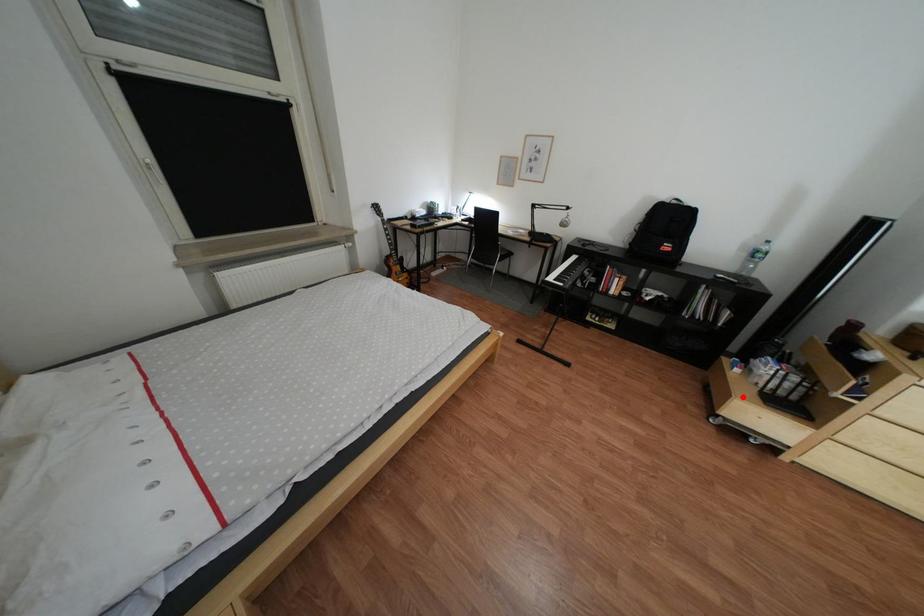
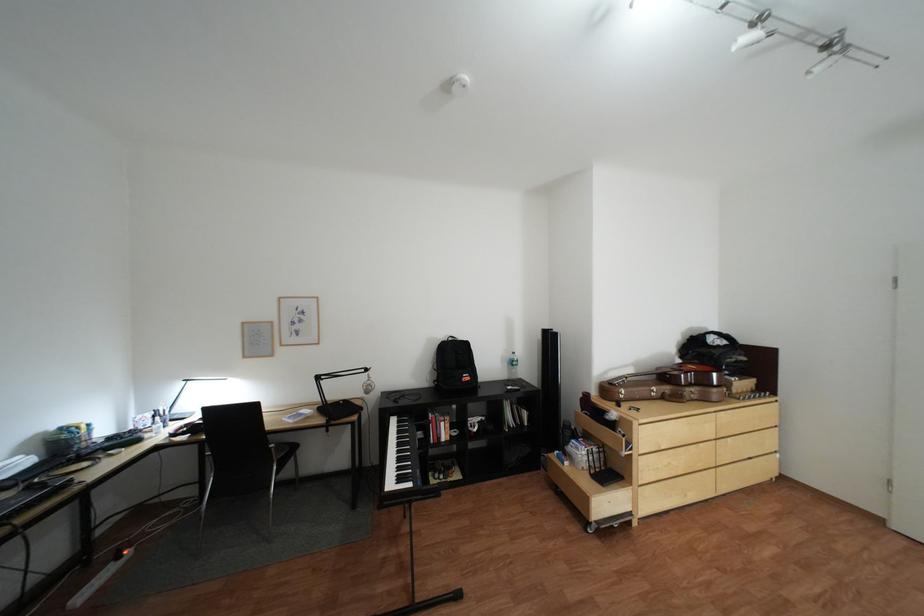
Question: A red point is marked in image1. In image2, is the corresponding 3D point closer to the camera or farther? Reply with the corresponding letter.

Choices:
 (A) The corresponding 3D point is closer.
 (B) The corresponding 3D point is farther.

Answer: (B)